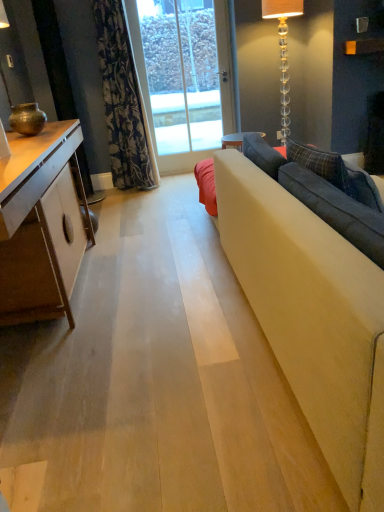
Question: Is floral fabric curtain at upper left a part of clear glass floor lamp at upper right, positioned as the second lamp in front-to-back order?

Choices:
 (A) no
 (B) yes

Answer: (A)

Question: Is clear glass floor lamp at upper right, placed as the 1th lamp when sorted from back to front, facing towards floral fabric curtain at upper left?

Choices:
 (A) no
 (B) yes

Answer: (A)

Question: Does clear glass floor lamp at upper right, positioned as the second lamp in front-to-back order, have a lesser width compared to floral fabric curtain at upper left?

Choices:
 (A) yes
 (B) no

Answer: (B)

Question: From the image's perspective, does clear glass floor lamp at upper right, placed as the 1th lamp when sorted from back to front, appear higher than floral fabric curtain at upper left?

Choices:
 (A) yes
 (B) no

Answer: (A)

Question: From a real-world perspective, is clear glass floor lamp at upper right, the first lamp viewed from the right, beneath floral fabric curtain at upper left?

Choices:
 (A) no
 (B) yes

Answer: (A)

Question: Based on their sizes in the image, would you say matte bronze lamp at left, which appears as the 2th lamp when viewed from the right, is bigger or smaller than floral fabric curtain at upper left?

Choices:
 (A) small
 (B) big

Answer: (A)

Question: In terms of width, does matte bronze lamp at left, which ranks as the 1th lamp in left-to-right order, look wider or thinner when compared to floral fabric curtain at upper left?

Choices:
 (A) wide
 (B) thin

Answer: (B)

Question: Is matte bronze lamp at left, positioned as the first lamp in front-to-back order, situated inside floral fabric curtain at upper left or outside?

Choices:
 (A) outside
 (B) inside

Answer: (A)

Question: Based on their positions, is matte bronze lamp at left, which appears as the 2th lamp when viewed from the right, located to the left or right of floral fabric curtain at upper left?

Choices:
 (A) left
 (B) right

Answer: (A)

Question: Choose the correct answer: Is clear glass floor lamp at upper right, the first lamp viewed from the right, inside floral fabric curtain at upper left or outside it?

Choices:
 (A) outside
 (B) inside

Answer: (A)

Question: Considering the positions of clear glass floor lamp at upper right, placed as the 1th lamp when sorted from back to front, and floral fabric curtain at upper left in the image, is clear glass floor lamp at upper right, placed as the 1th lamp when sorted from back to front, wider or thinner than floral fabric curtain at upper left?

Choices:
 (A) wide
 (B) thin

Answer: (A)

Question: From a real-world perspective, relative to floral fabric curtain at upper left, is clear glass floor lamp at upper right, the 2th lamp when ordered from left to right, vertically above or below?

Choices:
 (A) below
 (B) above

Answer: (B)

Question: Is clear glass floor lamp at upper right, the first lamp viewed from the right, bigger or smaller than floral fabric curtain at upper left?

Choices:
 (A) small
 (B) big

Answer: (A)

Question: In terms of height, does clear glass door at center look taller or shorter compared to clear glass floor lamp at upper right, positioned as the second lamp in front-to-back order?

Choices:
 (A) short
 (B) tall

Answer: (B)

Question: Based on their positions, is clear glass door at center located to the left or right of clear glass floor lamp at upper right, the 2th lamp when ordered from left to right?

Choices:
 (A) left
 (B) right

Answer: (A)